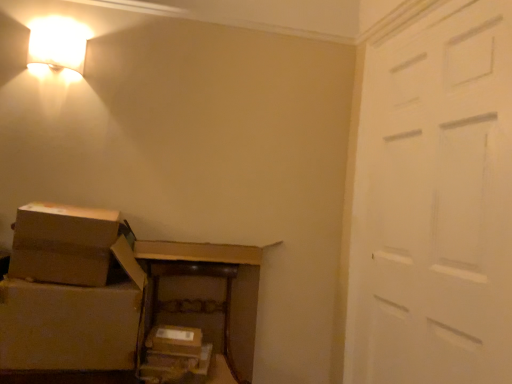
What do you see at coordinates (69, 245) in the screenshot?
I see `brown cardboard box at lower left, marked as the 1th box in a top-to-bottom arrangement` at bounding box center [69, 245].

Where is `brown cardboard box at lower left, marked as the second box in a bottom-to-top arrangement`? This screenshot has height=384, width=512. brown cardboard box at lower left, marked as the second box in a bottom-to-top arrangement is located at coordinates (69, 245).

The image size is (512, 384). Describe the element at coordinates (205, 300) in the screenshot. I see `brown cardboard boxes at lower center` at that location.

Identify the location of brown cardboard box at lower left, which ranks as the 2th box in top-to-bottom order. This screenshot has width=512, height=384. (68, 326).

What are the coordinates of `white matte door at right` in the screenshot? It's located at (435, 202).

Does brown cardboard boxes at lower center have a larger size compared to brown cardboard box at lower left, arranged as the first box when ordered from the bottom?

Indeed, brown cardboard boxes at lower center has a larger size compared to brown cardboard box at lower left, arranged as the first box when ordered from the bottom.

From the image's perspective, which is above, brown cardboard boxes at lower center or brown cardboard box at lower left, which ranks as the 2th box in top-to-bottom order?

brown cardboard box at lower left, which ranks as the 2th box in top-to-bottom order.

Where is `the 1st box above the brown cardboard boxes at lower center (from a real-world perspective)`? The width and height of the screenshot is (512, 384). the 1st box above the brown cardboard boxes at lower center (from a real-world perspective) is located at coordinates (68, 326).

Does brown cardboard boxes at lower center lie in front of brown cardboard box at lower left, arranged as the first box when ordered from the bottom?

No, brown cardboard boxes at lower center is further to the viewer.

Who is shorter, brown cardboard box at lower left, arranged as the first box when ordered from the bottom, or matte white wall sconce at upper left?

Standing shorter between the two is matte white wall sconce at upper left.

From the image's perspective, is brown cardboard box at lower left, which ranks as the 2th box in top-to-bottom order, on matte white wall sconce at upper left?

No, from the image's perspective, brown cardboard box at lower left, which ranks as the 2th box in top-to-bottom order, is not above matte white wall sconce at upper left.

From a real-world perspective, which object rests below the other?

brown cardboard box at lower left, arranged as the first box when ordered from the bottom.

Based on the photo, considering the positions of objects brown cardboard box at lower left, which ranks as the 2th box in top-to-bottom order, and matte white wall sconce at upper left in the image provided, who is more to the left, brown cardboard box at lower left, which ranks as the 2th box in top-to-bottom order, or matte white wall sconce at upper left?

Positioned to the left is matte white wall sconce at upper left.

Visually, is white matte door at right positioned to the left or to the right of brown cardboard box at lower center, the 2th storage box when ordered from bottom to top?

In the image, white matte door at right appears on the right side of brown cardboard box at lower center, the 2th storage box when ordered from bottom to top.

Which of these two, white matte door at right or brown cardboard box at lower center, the 2th storage box when ordered from bottom to top, is smaller?

With smaller size is brown cardboard box at lower center, the 2th storage box when ordered from bottom to top.

Considering the sizes of white matte door at right and brown cardboard box at lower center, which is the 1th storage box from top to bottom, in the image, is white matte door at right wider or thinner than brown cardboard box at lower center, which is the 1th storage box from top to bottom,?

Considering their sizes, white matte door at right looks slimmer than brown cardboard box at lower center, which is the 1th storage box from top to bottom.

From the image's perspective, is white matte door at right under brown cardboard box at lower center, the 2th storage box when ordered from bottom to top?

Actually, white matte door at right appears above brown cardboard box at lower center, the 2th storage box when ordered from bottom to top, in the image.

Image resolution: width=512 pixels, height=384 pixels. Identify the location of box on the left of brown cardboard box at lower left, arranged as the first box when ordered from the bottom. (69, 245).

Between brown cardboard box at lower left, which ranks as the 2th box in top-to-bottom order, and brown cardboard box at lower left, marked as the second box in a bottom-to-top arrangement, which one has smaller size?

brown cardboard box at lower left, marked as the second box in a bottom-to-top arrangement.

From a real-world perspective, which is physically above, brown cardboard box at lower left, which ranks as the 2th box in top-to-bottom order, or brown cardboard box at lower left, marked as the second box in a bottom-to-top arrangement?

brown cardboard box at lower left, marked as the second box in a bottom-to-top arrangement, is physically above.

Is brown cardboard box at lower left, arranged as the first box when ordered from the bottom, located outside brown cardboard box at lower left, marked as the second box in a bottom-to-top arrangement?

Yes.

Is brown cardboard boxes at lower center directly adjacent to white matte door at right?

They are not placed beside each other.

Locate an element on the screen. The width and height of the screenshot is (512, 384). furniture that appears behind the white matte door at right is located at coordinates (205, 300).

From the image's perspective, is brown cardboard boxes at lower center above or below white matte door at right?

Clearly, from the image's perspective, brown cardboard boxes at lower center is below white matte door at right.

Is brown cardboard box at lower left, marked as the 1th box in a top-to-bottom arrangement, positioned with its back to white matte door at right?

No, brown cardboard box at lower left, marked as the 1th box in a top-to-bottom arrangement, is not facing the opposite direction of white matte door at right.

Which is in front, point (42, 274) or point (478, 102)?

Positioned in front is point (478, 102).

Is brown cardboard box at lower left, marked as the second box in a bottom-to-top arrangement, with white matte door at right?

brown cardboard box at lower left, marked as the second box in a bottom-to-top arrangement, is not next to white matte door at right, and they're not touching.

How different are the orientations of brown cardboard box at lower left, marked as the 1th box in a top-to-bottom arrangement, and white matte door at right in degrees?

brown cardboard box at lower left, marked as the 1th box in a top-to-bottom arrangement, and white matte door at right are facing 91.7 degrees away from each other.

Consider the image. Does brown cardboard box at lower center, the 2th storage box when ordered from bottom to top, turn towards matte white wall sconce at upper left?

No, brown cardboard box at lower center, the 2th storage box when ordered from bottom to top, is not turned towards matte white wall sconce at upper left.

Which object is positioned more to the left, brown cardboard box at lower center, the 2th storage box when ordered from bottom to top, or matte white wall sconce at upper left?

matte white wall sconce at upper left is more to the left.

Based on the photo, does brown cardboard box at lower center, which is the 1th storage box from top to bottom, have a larger size compared to matte white wall sconce at upper left?

No, brown cardboard box at lower center, which is the 1th storage box from top to bottom, is not bigger than matte white wall sconce at upper left.

From a real-world perspective, is brown cardboard box at lower center, which is the 1th storage box from top to bottom, positioned above or below matte white wall sconce at upper left?

brown cardboard box at lower center, which is the 1th storage box from top to bottom, is situated lower than matte white wall sconce at upper left in the real world.

There is a brown cardboard boxes at lower center. Identify the location of the 1st box above it (from the image's perspective). (68, 326).

Where is `box that is the 2nd object located in front of the matte white wall sconce at upper left`? box that is the 2nd object located in front of the matte white wall sconce at upper left is located at coordinates (68, 326).

Looking at the image, which one is located further to brown cardboard box at lower left, marked as the 1th box in a top-to-bottom arrangement, brown cardboard box at lower center, the 2th storage box when ordered from bottom to top, or matte white wall sconce at upper left?

matte white wall sconce at upper left.

Considering their positions, is brown cardboard box at lower left, which ranks as the 2th box in top-to-bottom order, positioned closer to brown cardboard box at lower center, the 2th storage box in the top-to-bottom sequence, than brown cardboard box at lower left, marked as the second box in a bottom-to-top arrangement?

brown cardboard box at lower left, which ranks as the 2th box in top-to-bottom order, lies closer to brown cardboard box at lower center, the 2th storage box in the top-to-bottom sequence, than the other object.

When comparing their distances from brown cardboard box at lower left, marked as the second box in a bottom-to-top arrangement, does brown cardboard box at lower left, which ranks as the 2th box in top-to-bottom order, or brown cardboard boxes at lower center seem further?

The object further to brown cardboard box at lower left, marked as the second box in a bottom-to-top arrangement, is brown cardboard boxes at lower center.

From the image, which object appears to be nearer to brown cardboard box at lower left, arranged as the first box when ordered from the bottom, white matte door at right or brown cardboard box at lower left, marked as the second box in a bottom-to-top arrangement?

brown cardboard box at lower left, marked as the second box in a bottom-to-top arrangement, is closer to brown cardboard box at lower left, arranged as the first box when ordered from the bottom.

Estimate the real-world distances between objects in this image. Which object is closer to matte white wall sconce at upper left, brown cardboard box at lower left, which ranks as the 2th box in top-to-bottom order, or brown cardboard box at lower center, the 2th storage box when ordered from bottom to top?

Among the two, brown cardboard box at lower left, which ranks as the 2th box in top-to-bottom order, is located nearer to matte white wall sconce at upper left.

Looking at the image, which one is located further to brown cardboard boxes at lower center, brown cardboard box at lower left, marked as the 1th box in a top-to-bottom arrangement, or brown cardboard box at lower center, marked as the 1th storage box in a bottom-to-top arrangement?

brown cardboard box at lower left, marked as the 1th box in a top-to-bottom arrangement, is further to brown cardboard boxes at lower center.

Estimate the real-world distances between objects in this image. Which object is closer to white matte door at right, brown cardboard boxes at lower center or brown cardboard box at lower center, which is the 1th storage box from top to bottom?

brown cardboard boxes at lower center is positioned closer to the anchor white matte door at right.

When comparing their distances from white matte door at right, does brown cardboard box at lower center, the 2th storage box when ordered from bottom to top, or brown cardboard box at lower center, the 2th storage box in the top-to-bottom sequence, seem further?

Based on the image, brown cardboard box at lower center, the 2th storage box when ordered from bottom to top, appears to be further to white matte door at right.

Identify the location of storage box between matte white wall sconce at upper left and brown cardboard box at lower center, marked as the 1th storage box in a bottom-to-top arrangement, vertically. (175, 340).

Image resolution: width=512 pixels, height=384 pixels. I want to click on furniture situated between brown cardboard box at lower center, which is the 1th storage box from top to bottom, and white matte door at right from left to right, so click(x=205, y=300).

You are a GUI agent. You are given a task and a screenshot of the screen. Output one action in this format:
    pyautogui.click(x=<x>, y=<y>)
    Task: Click on the storage box between brown cardboard box at lower left, arranged as the first box when ordered from the bottom, and brown cardboard box at lower center, the 2th storage box in the top-to-bottom sequence
    
    Given the screenshot: What is the action you would take?
    pyautogui.click(x=175, y=340)

Where is `box between brown cardboard box at lower left, marked as the 1th box in a top-to-bottom arrangement, and brown cardboard boxes at lower center`? box between brown cardboard box at lower left, marked as the 1th box in a top-to-bottom arrangement, and brown cardboard boxes at lower center is located at coordinates (68, 326).